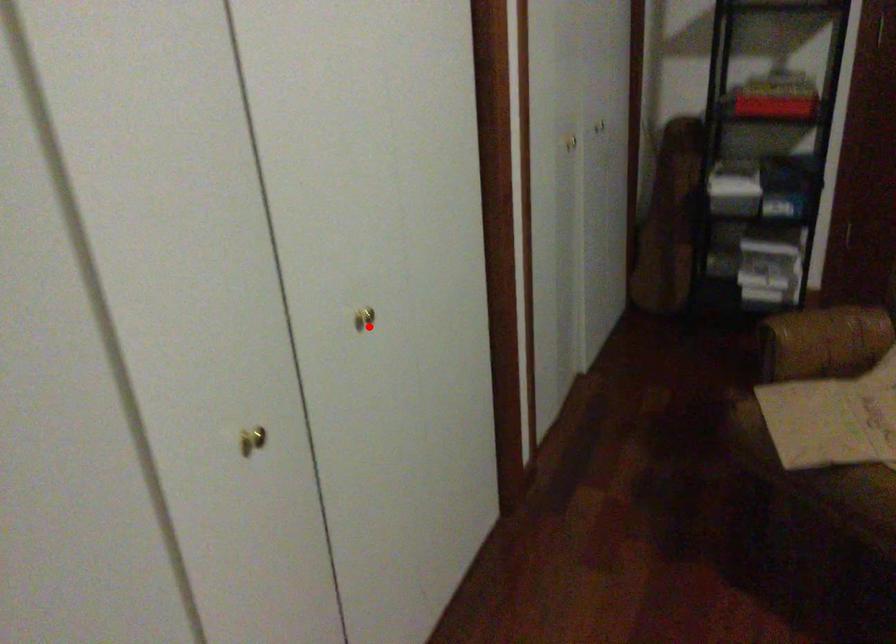
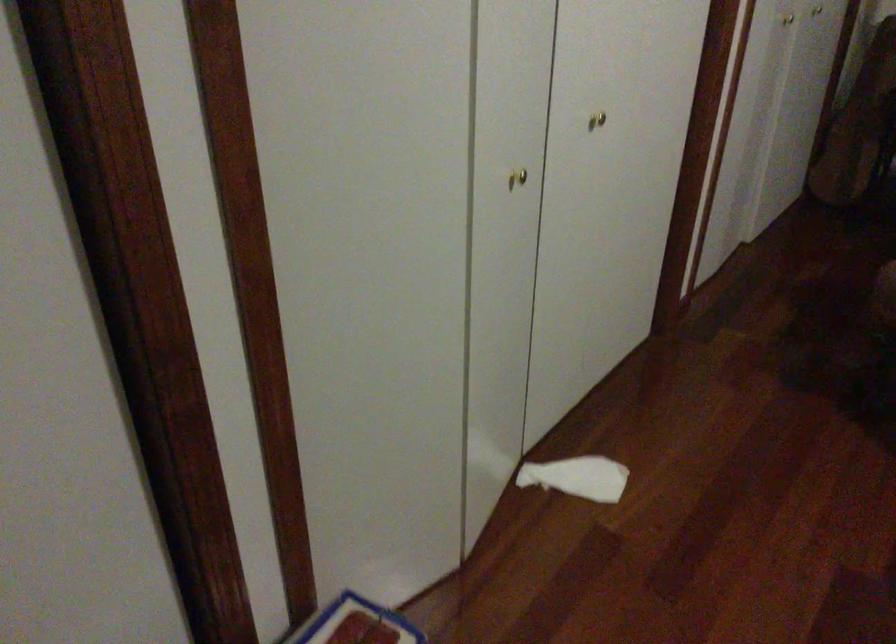
Find the pixel in the second image that matches the highlighted location in the first image.

(597, 120)